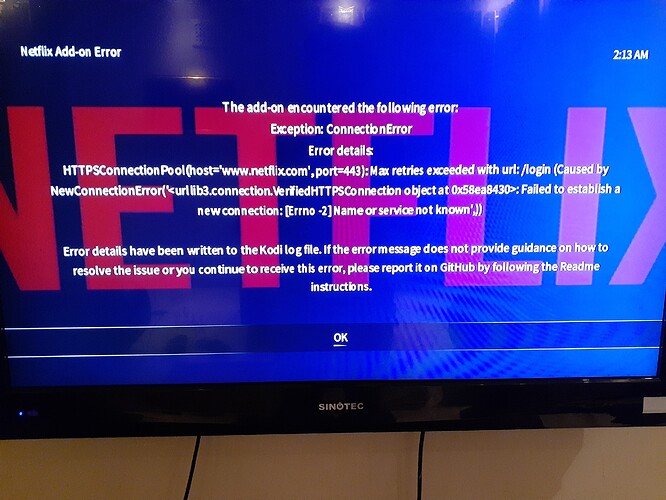
Locate an element on the screen. Image resolution: width=666 pixels, height=500 pixels. grout line is located at coordinates (190, 468), (419, 464).